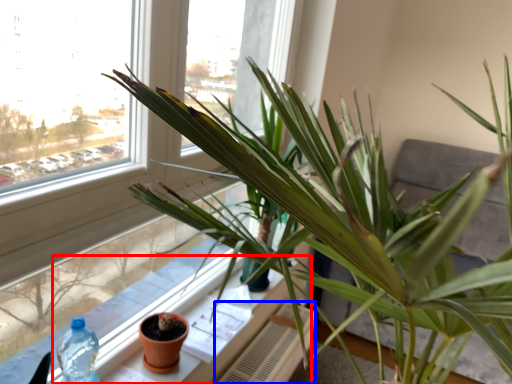
Question: Among these objects, which one is farthest to the camera, window sill (highlighted by a red box) or radiator (highlighted by a blue box)?

Choices:
 (A) window sill
 (B) radiator

Answer: (B)